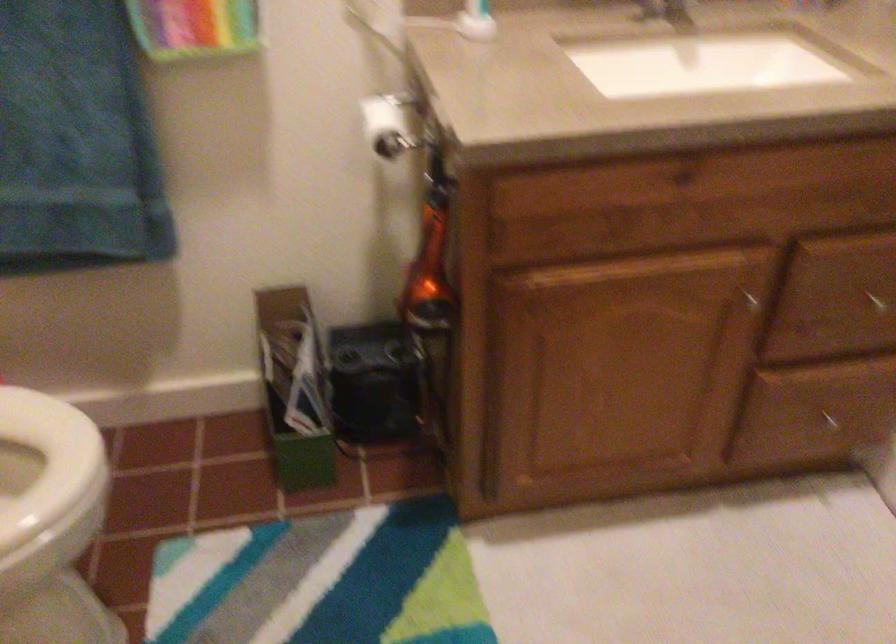
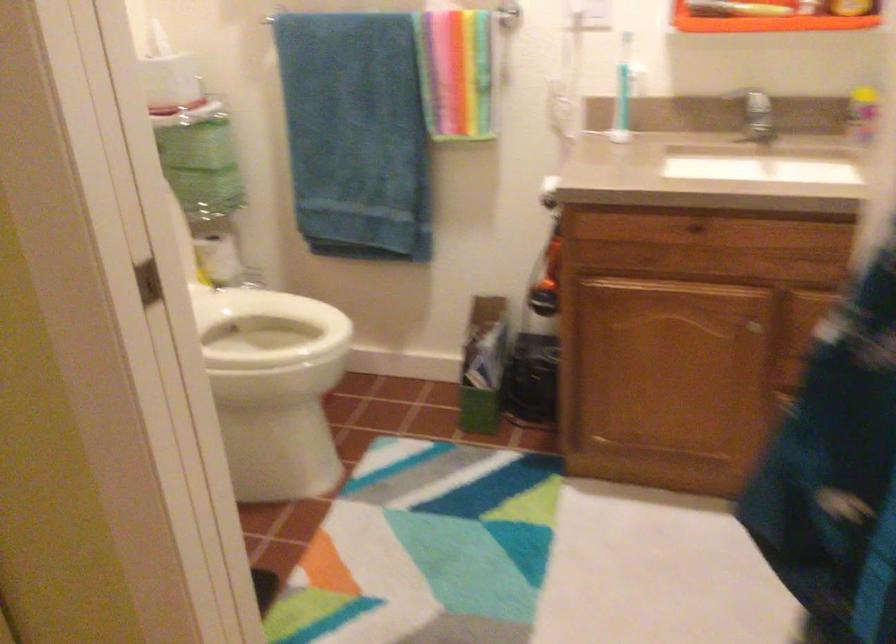
Which direction would the cameraman need to move to produce the second image?

The cameraman walked toward right, backward.